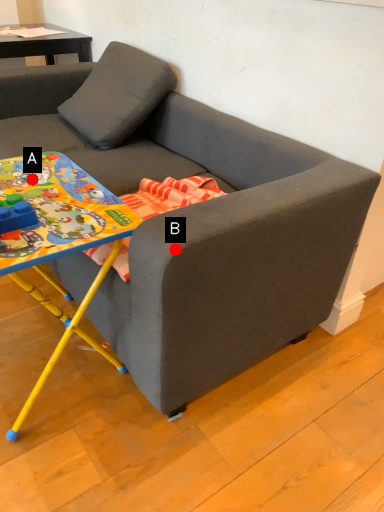
Question: Two points are circled on the image, labeled by A and B beside each circle. Among these points, which one is nearest to the camera?

Choices:
 (A) A is closer
 (B) B is closer

Answer: (B)